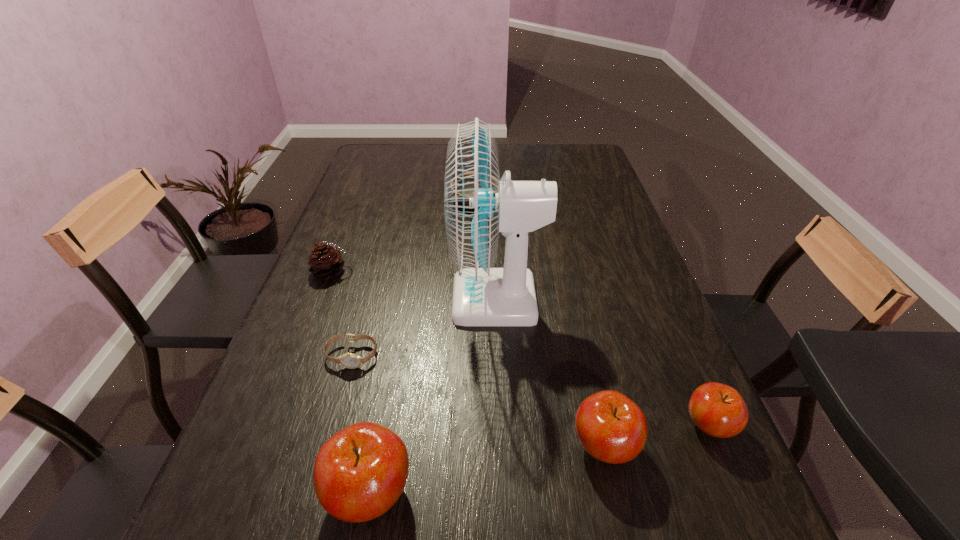
You are a GUI agent. You are given a task and a screenshot of the screen. Output one action in this format:
    pyautogui.click(x=<x>, y=<y>)
    Task: Click on the free area in between the watch and the leftmost object
    
    Given the screenshot: What is the action you would take?
    pyautogui.click(x=343, y=314)

You are a GUI agent. You are given a task and a screenshot of the screen. Output one action in this format:
    pyautogui.click(x=<x>, y=<y>)
    Task: Click on the free space between the second apple from left to right and the rightmost object
    
    Given the screenshot: What is the action you would take?
    pyautogui.click(x=657, y=436)

Select which object is the third closest to the pinecone. Please provide its 2D coordinates. Your answer should be formatted as a tuple, i.e. [(x, y)], where the tuple contains the x and y coordinates of a point satisfying the conditions above.

[(360, 472)]

Choose which object is the second nearest neighbor to the tallest apple. Please provide its 2D coordinates. Your answer should be formatted as a tuple, i.e. [(x, y)], where the tuple contains the x and y coordinates of a point satisfying the conditions above.

[(478, 205)]

The width and height of the screenshot is (960, 540). In order to click on the closest apple to the shortest apple in this screenshot , I will do `click(612, 428)`.

The height and width of the screenshot is (540, 960). I want to click on apple that is the second closest to the rightmost apple, so click(360, 472).

The height and width of the screenshot is (540, 960). I want to click on vacant space that satisfies the following two spatial constraints: 1. with a leaf charm attached to the pinecone; 2. on the right side of the leftmost apple, so click(x=247, y=492).

Locate an element on the screen. free region that satisfies the following two spatial constraints: 1. on the back side of the shortest apple; 2. on the left side of the second tallest apple is located at coordinates (600, 426).

At what (x,y) coordinates should I click in order to perform the action: click on vacant area in the image that satisfies the following two spatial constraints: 1. in front of the second apple from left to right to face the airflow; 2. on the right side of the fourth object from left to right. Please return your answer as a coordinate pair (x, y). This screenshot has height=540, width=960. Looking at the image, I should click on (503, 446).

Where is `free space that satisfies the following two spatial constraints: 1. with a leaf charm attached to the leftmost object; 2. on the left side of the second apple from right to left`? free space that satisfies the following two spatial constraints: 1. with a leaf charm attached to the leftmost object; 2. on the left side of the second apple from right to left is located at coordinates (265, 446).